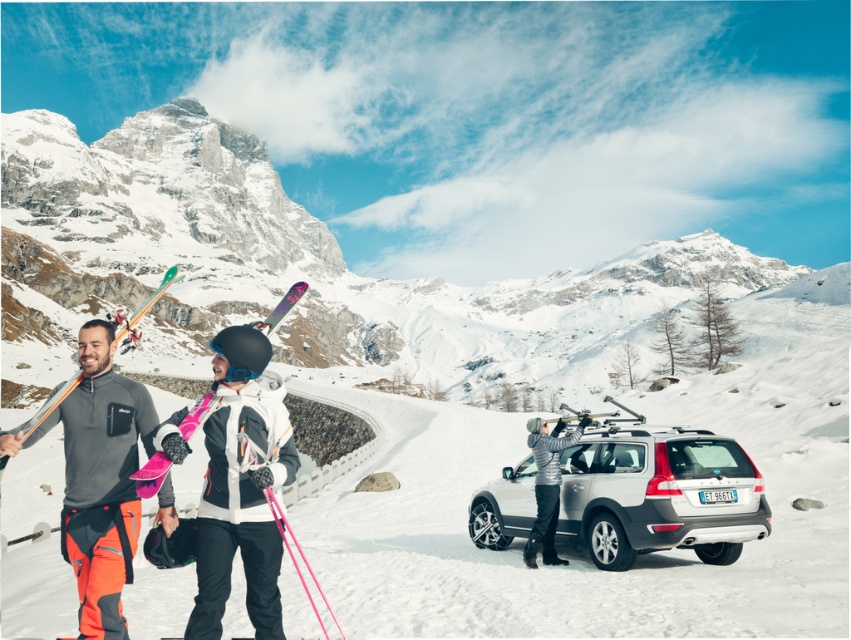
Find the location of a particular element. The height and width of the screenshot is (640, 851). snowy granite mountain at upper left is located at coordinates (333, 272).

Does snowy granite mountain at upper left have a greater width compared to matte pink snowboard at center?

Yes.

Is point (41, 188) more distant than point (281, 413)?

Yes, it is.

Locate an element on the screen. snowy granite mountain at upper left is located at coordinates (333, 272).

Is orange ski pants at left bigger than wooden skis at left?

Actually, orange ski pants at left might be smaller than wooden skis at left.

The height and width of the screenshot is (640, 851). I want to click on orange ski pants at left, so click(101, 474).

Where is `orange ski pants at left`? The width and height of the screenshot is (851, 640). orange ski pants at left is located at coordinates (101, 474).

Which is in front, point (244, 424) or point (204, 416)?

Point (204, 416) is in front.

In the scene shown: Is matte pink snowboard at center shorter than pink matte skis at center?

No.

Image resolution: width=851 pixels, height=640 pixels. What do you see at coordinates (241, 484) in the screenshot? I see `matte pink snowboard at center` at bounding box center [241, 484].

The width and height of the screenshot is (851, 640). What are the coordinates of `matte pink snowboard at center` in the screenshot? It's located at (241, 484).